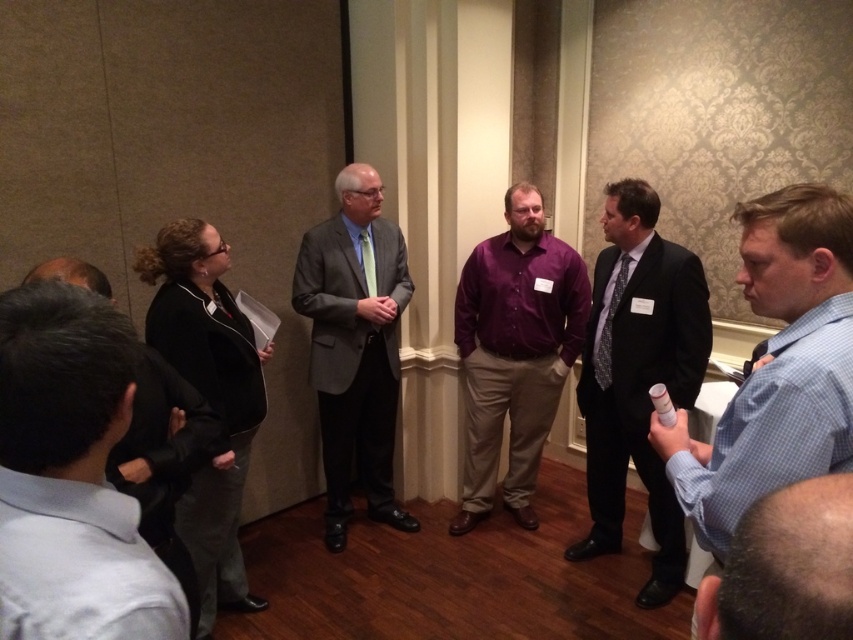
You are attending a formal event and notice two individuals in the center of the image wearing suits. The first is described as a matte black suit at center and the second as a matte gray suit at center. Based on their positions, which one is closer to the front of the room?

The matte black suit at center is closer to the front of the room because it is located below the matte gray suit at center, indicating it is positioned lower in the image and thus nearer to the viewer.

In the scene shown: You are attending a formal event and need to find a seat between the blue checkered shirt at right and the matte black suit at center. Which direction should you walk to reach the seat closer to the shorter person?

The blue checkered shirt at right is shorter than the matte black suit at center. Therefore, you should walk towards the blue checkered shirt at right to reach the seat closer to the shorter person.

You are standing in the conference room and want to determine which of the two points, point (807,211) or point (386,317), is closer to you. Based on the spatial arrangement, which point is nearer?

Point (807,211) is closer to the viewer than point (386,317).